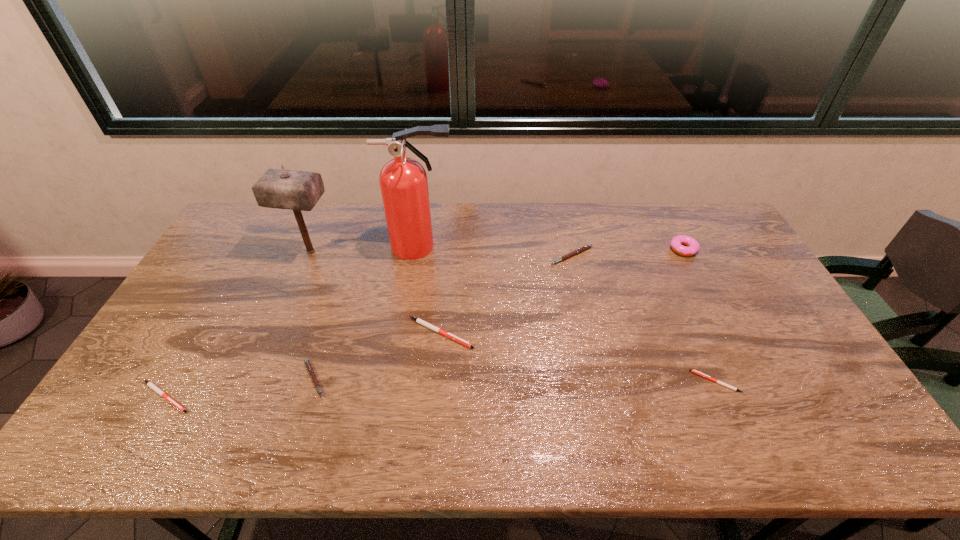
Locate which white pen ranks third in proximity to the third object from left to right. Please provide its 2D coordinates. Your answer should be formatted as a tuple, i.e. [(x, y)], where the tuple contains the x and y coordinates of a point satisfying the conditions above.

[(694, 371)]

The width and height of the screenshot is (960, 540). In order to click on vacant region that satisfies the following two spatial constraints: 1. on the front side of the mallet; 2. on the clicker of the leftmost object in this screenshot , I will do `click(250, 396)`.

The image size is (960, 540). Identify the location of free point that satisfies the following two spatial constraints: 1. on the front side of the doughnut; 2. on the clicker of the third pen from right to left. (726, 333).

Locate an element on the screen. free space that satisfies the following two spatial constraints: 1. at the nib of the bigger pink pen; 2. at the nib of the nearer pink pen is located at coordinates (599, 379).